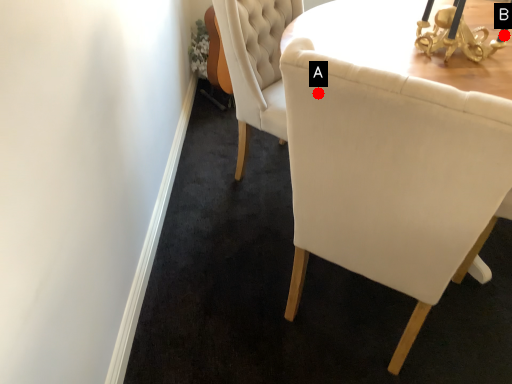
Question: Two points are circled on the image, labeled by A and B beside each circle. Which of the following is the farthest from the observer?

Choices:
 (A) A is further
 (B) B is further

Answer: (B)